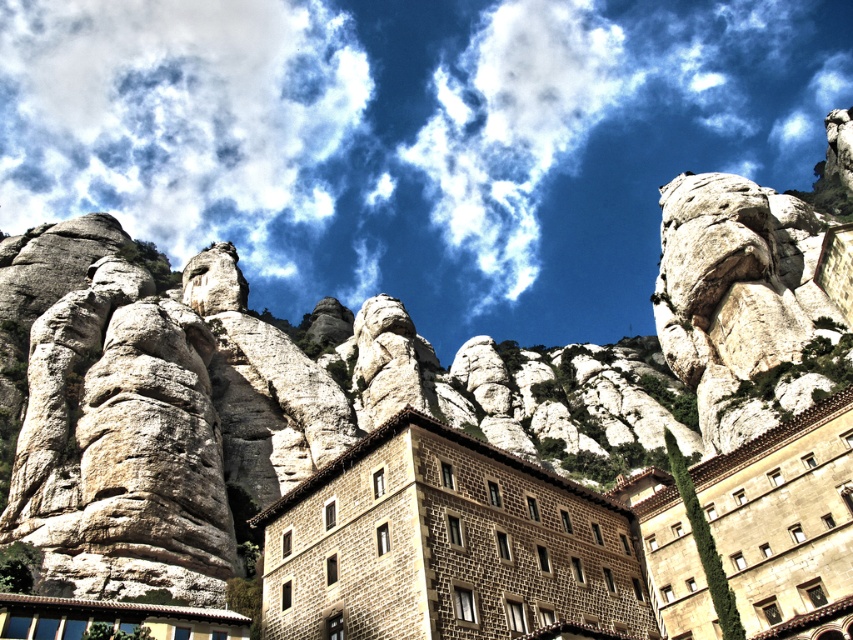
Question: Can you confirm if white fluffy cloud at upper center is bigger than brown stone building at center?

Choices:
 (A) yes
 (B) no

Answer: (A)

Question: Among these points, which one is farthest from the camera?

Choices:
 (A) (467, 460)
 (B) (619, 116)

Answer: (B)

Question: Which of the following is the farthest from the observer?

Choices:
 (A) (601, 305)
 (B) (625, 541)

Answer: (A)

Question: Is white fluffy cloud at upper center above brown stone building at center?

Choices:
 (A) yes
 (B) no

Answer: (A)

Question: Is white fluffy cloud at upper center bigger than brown stone building at center?

Choices:
 (A) no
 (B) yes

Answer: (B)